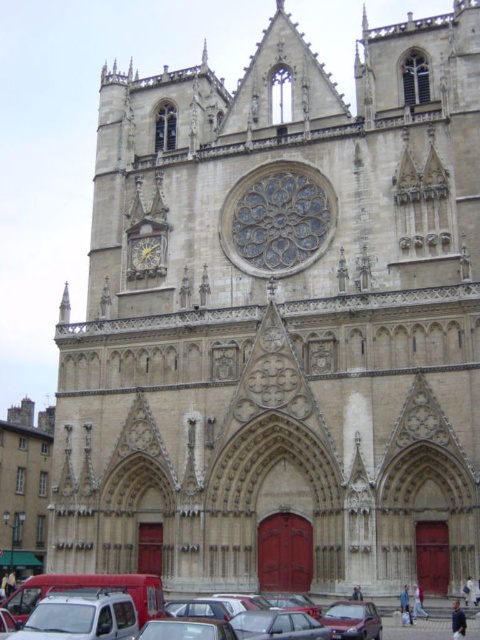
You are standing in front of the cathedral and want to know which of the two points, point (333, 618) or point (144, 240), is closer to you. Based on their positions, which one would you say is nearer?

Point (333, 618) is in front of point (144, 240), so it is closer to you.